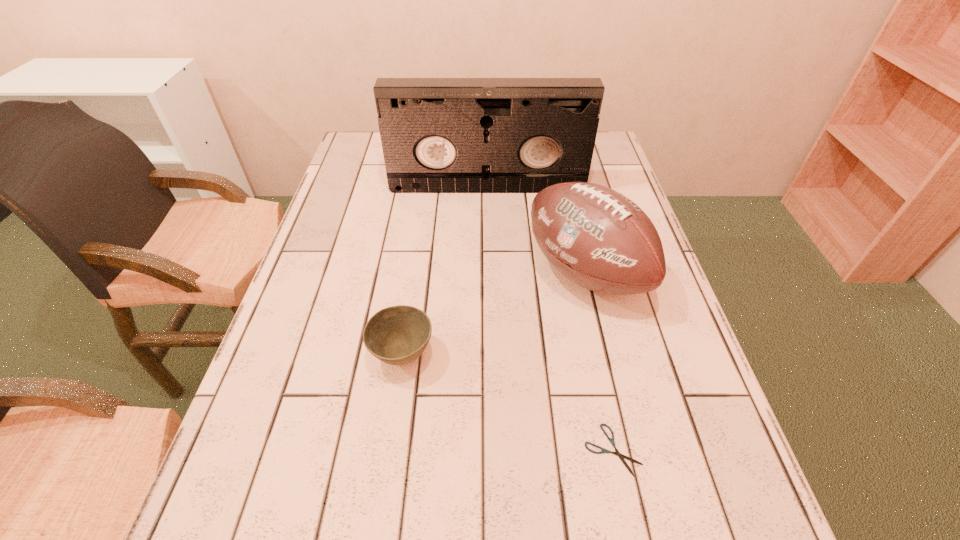
I want to click on free space that satisfies the following two spatial constraints: 1. on the front side of the videotape; 2. on the right side of the shortest object, so click(492, 450).

This screenshot has height=540, width=960. Find the location of `vacant space that satisfies the following two spatial constraints: 1. on the front side of the farthest object; 2. on the right side of the shortest object`. vacant space that satisfies the following two spatial constraints: 1. on the front side of the farthest object; 2. on the right side of the shortest object is located at coordinates (492, 450).

This screenshot has height=540, width=960. I want to click on vacant space that satisfies the following two spatial constraints: 1. on the front side of the nearest object; 2. on the right side of the videotape, so click(x=492, y=450).